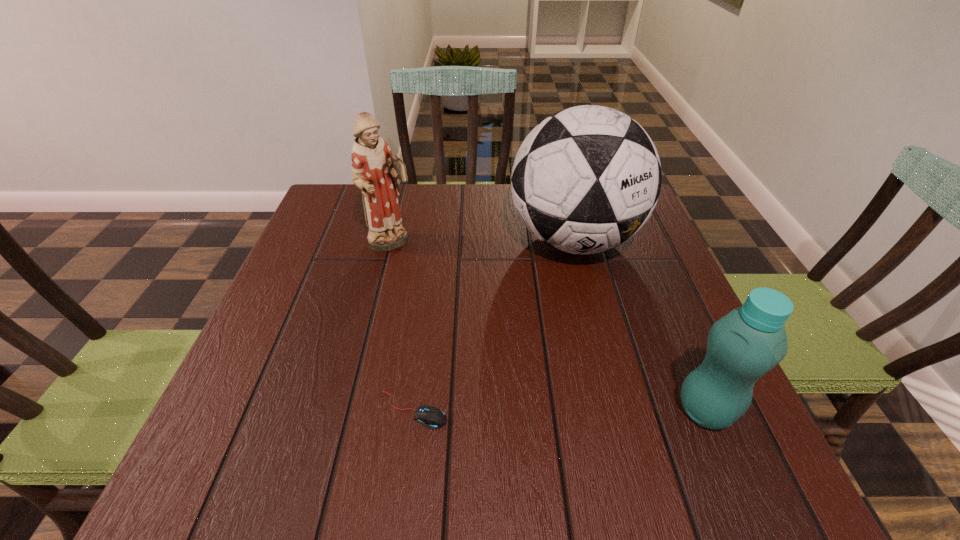
Locate an element on the screen. The image size is (960, 540). the shortest object is located at coordinates (431, 417).

Locate an element on the screen. the second shortest object is located at coordinates (748, 342).

You are a GUI agent. You are given a task and a screenshot of the screen. Output one action in this format:
    pyautogui.click(x=<x>, y=<y>)
    Task: Click on the soccer ball
    Image resolution: width=960 pixels, height=540 pixels.
    Given the screenshot: What is the action you would take?
    pyautogui.click(x=586, y=179)

The width and height of the screenshot is (960, 540). I want to click on figurine, so click(375, 171).

Identify the location of vacant position located on the right of the mouse. This screenshot has width=960, height=540. (518, 410).

At what (x,y) coordinates should I click in order to perform the action: click on free space located on the surface of the soccer ball where the brand logo is visible. Please return your answer as a coordinate pair (x, y). The height and width of the screenshot is (540, 960). Looking at the image, I should click on (600, 423).

Where is `free space located on the surface of the soccer ball where the brand logo is visible`? free space located on the surface of the soccer ball where the brand logo is visible is located at coordinates (601, 428).

At what (x,y) coordinates should I click in order to perform the action: click on vacant space located 0.180m on the surface of the soccer ball where the brand logo is visible. Please return your answer as a coordinate pair (x, y). Looking at the image, I should click on (589, 348).

At what (x,y) coordinates should I click in order to perform the action: click on blank area located 0.370m on the front-facing side of the figurine. Please return your answer as a coordinate pair (x, y). Looking at the image, I should click on (512, 345).

This screenshot has width=960, height=540. I want to click on free space located on the front-facing side of the figurine, so click(452, 293).